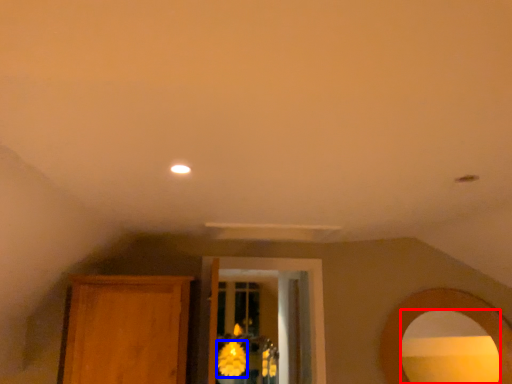
Question: Among these objects, which one is nearest to the camera, mirror (highlighted by a red box) or flower (highlighted by a blue box)?

Choices:
 (A) mirror
 (B) flower

Answer: (A)